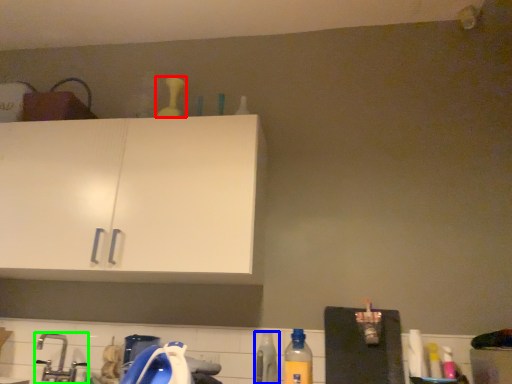
Question: Which object is positioned farthest from bottle (highlighted by a red box)? Select from bottle (highlighted by a blue box) and faucet (highlighted by a green box).

Choices:
 (A) bottle
 (B) faucet

Answer: (A)